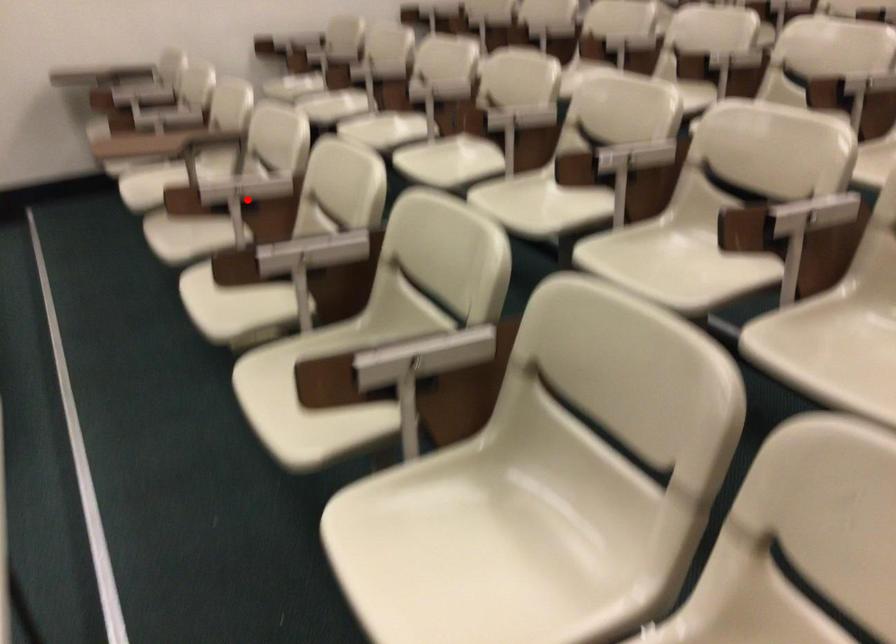
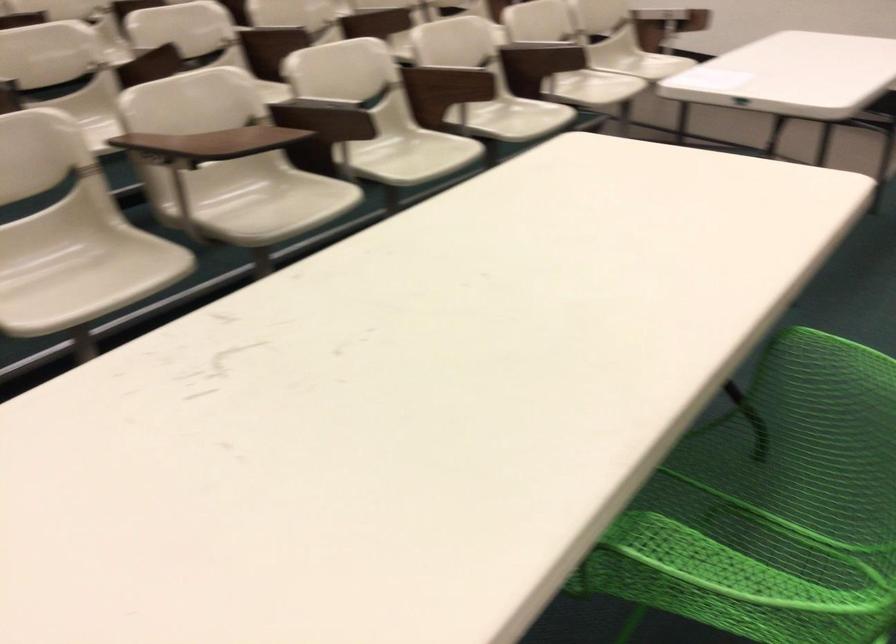
Locate, in the second image, the point that corresponds to the highlighted location in the first image.

(340, 120)